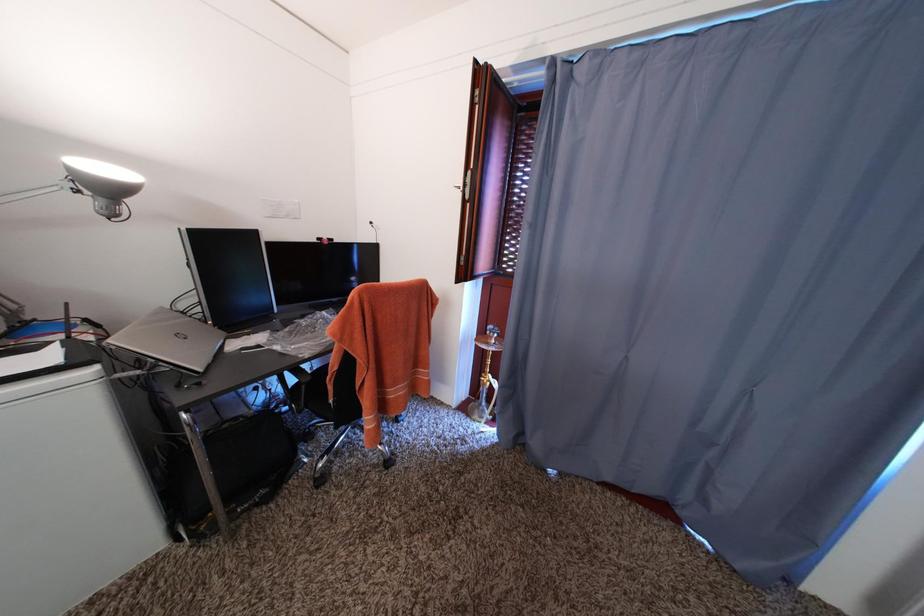
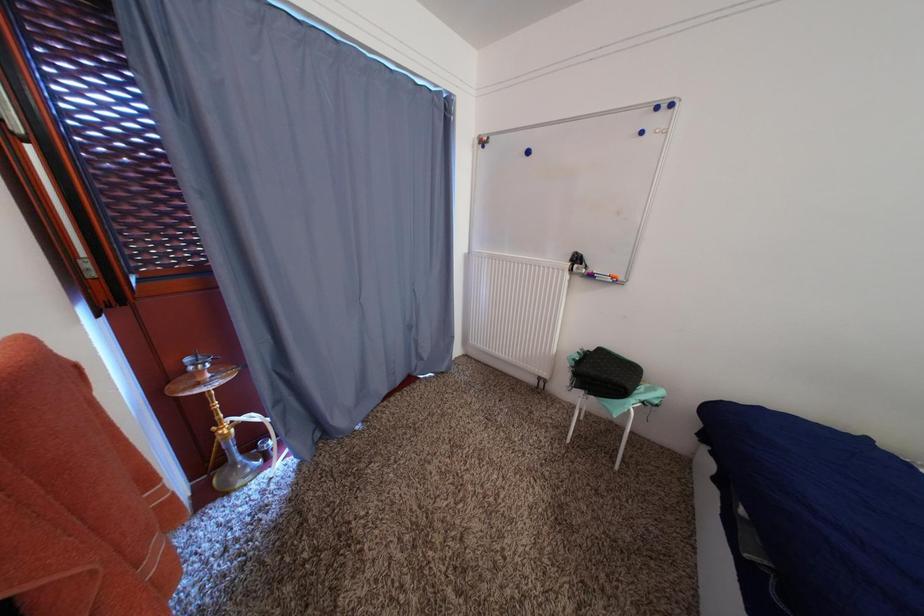
First-person continuous shooting, in which direction is the camera rotating?

The camera rotated toward right-down.